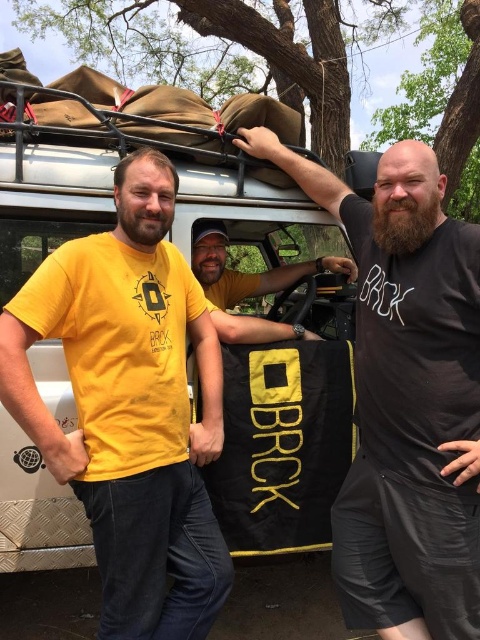
Which is above, yellow matte t-shirt at left or yellow t-shirt at center?

yellow t-shirt at center is higher up.

In the scene shown: Is yellow matte t-shirt at left further to the viewer compared to yellow t-shirt at center?

That is False.

Which is behind, point (164, 534) or point (213, 289)?

The point (213, 289) is more distant.

Find the location of a particular element. The height and width of the screenshot is (640, 480). yellow matte t-shirt at left is located at coordinates (130, 406).

Measure the distance between point (8,394) and camera.

Point (8,394) and camera are 5.71 feet apart from each other.

I want to click on yellow matte t-shirt at left, so tap(130, 406).

The width and height of the screenshot is (480, 640). Find the location of `yellow matte t-shirt at left`. yellow matte t-shirt at left is located at coordinates (130, 406).

Does black matte bag at upper center have a larger size compared to yellow t-shirt at center?

Correct, black matte bag at upper center is larger in size than yellow t-shirt at center.

Can you confirm if black matte bag at upper center is positioned above yellow t-shirt at center?

No, black matte bag at upper center is not above yellow t-shirt at center.

Which is in front, point (468, 461) or point (262, 289)?

Positioned in front is point (468, 461).

Where is `black matte bag at upper center`? black matte bag at upper center is located at coordinates (407, 396).